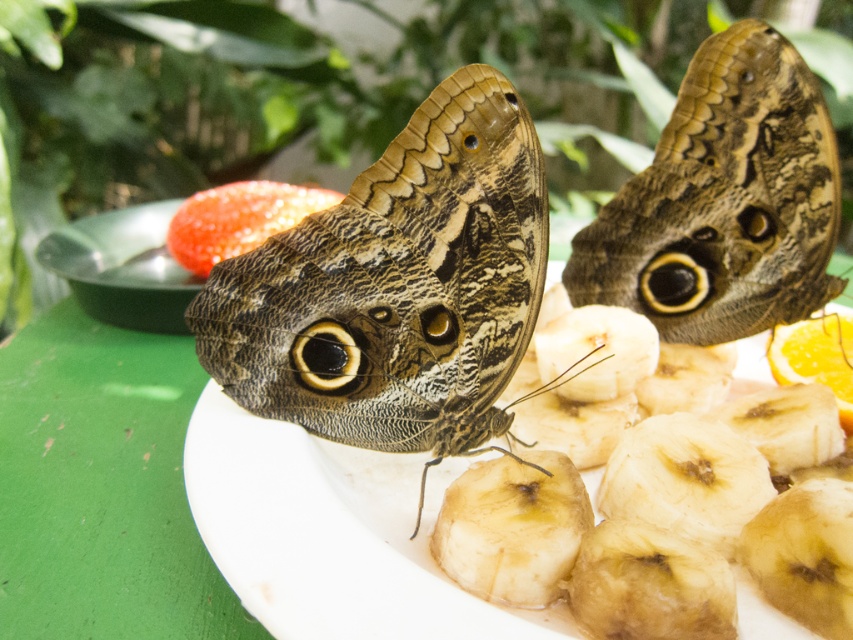
Between camouflage-patterned butterfly at upper right and orangesmoothfruit at right, which one is positioned higher?

Positioned higher is camouflage-patterned butterfly at upper right.

Between point (601, 259) and point (834, 362), which one is positioned in front?

Point (834, 362) is more forward.

Is point (808, 220) closer to camera compared to point (817, 360)?

Yes, point (808, 220) is in front of point (817, 360).

Image resolution: width=853 pixels, height=640 pixels. I want to click on camouflage-patterned butterfly at upper right, so click(723, 202).

Who is positioned more to the left, camouflage-patterned butterfly at upper right or smooth white plate at center?

smooth white plate at center is more to the left.

Is point (637, 275) farther from camera compared to point (285, 545)?

Yes, point (637, 275) is farther from viewer.

Is point (581, 243) behind point (306, 458)?

That is True.

Where is `camouflage-patterned butterfly at upper right`? This screenshot has height=640, width=853. camouflage-patterned butterfly at upper right is located at coordinates (723, 202).

Does brown textured butterfly at center appear under orangesmoothfruit at right?

No.

Between brown textured butterfly at center and orangesmoothfruit at right, which one has more height?

With more height is brown textured butterfly at center.

Between point (332, 387) and point (790, 348), which one is positioned behind?

Point (790, 348)

Locate an element on the screen. Image resolution: width=853 pixels, height=640 pixels. brown textured butterfly at center is located at coordinates (396, 285).